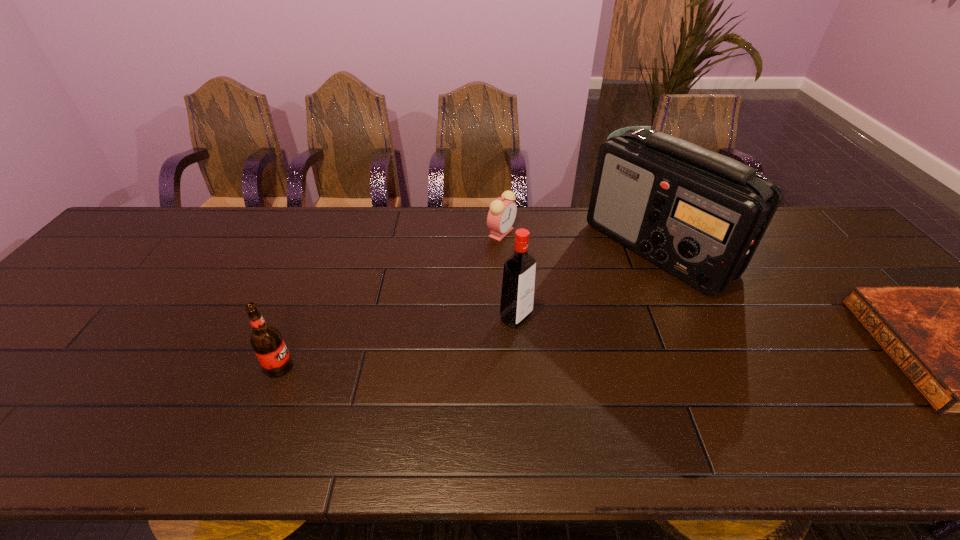
The width and height of the screenshot is (960, 540). I want to click on free region located on the front panel of the radio receiver, so click(637, 380).

Locate an element on the screen. This screenshot has width=960, height=540. free location located on the front panel of the radio receiver is located at coordinates (641, 360).

Where is `vacant region located on the front panel of the radio receiver`? This screenshot has width=960, height=540. vacant region located on the front panel of the radio receiver is located at coordinates (642, 350).

Find the location of `vacant position located 0.220m on the face of the second shortest object`. vacant position located 0.220m on the face of the second shortest object is located at coordinates (532, 291).

Locate an element on the screen. Image resolution: width=960 pixels, height=540 pixels. vacant space situated on the face of the second shortest object is located at coordinates (529, 286).

The width and height of the screenshot is (960, 540). What are the coordinates of `vacant point located on the face of the second shortest object` in the screenshot? It's located at (547, 320).

The width and height of the screenshot is (960, 540). Identify the location of radio receiver that is at the far edge. (700, 215).

Locate an element on the screen. The height and width of the screenshot is (540, 960). alarm clock present at the far edge is located at coordinates (501, 216).

At what (x,y) coordinates should I click in order to perform the action: click on object present at the near edge. Please return your answer as a coordinate pair (x, y). Looking at the image, I should click on (267, 342).

Locate an element on the screen. free region at the far edge of the desktop is located at coordinates (602, 234).